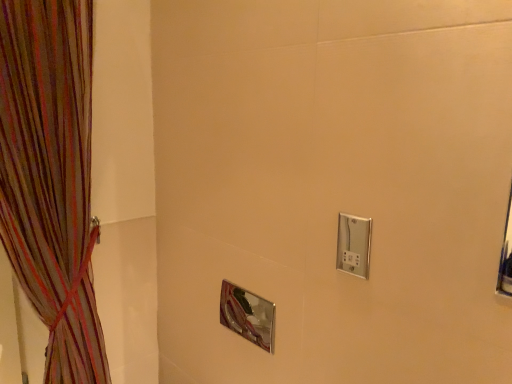
Question: From the image's perspective, is multicolored sheer curtain at left above or below satin nickel switch at upper right?

Choices:
 (A) above
 (B) below

Answer: (A)

Question: From their relative heights in the image, would you say multicolored sheer curtain at left is taller or shorter than satin nickel switch at upper right?

Choices:
 (A) tall
 (B) short

Answer: (A)

Question: Based on their relative distances, which object is farther from the polished chrome mirror at center?

Choices:
 (A) satin nickel switch at upper right
 (B) multicolored sheer curtain at left

Answer: (B)

Question: Based on their relative distances, which object is nearer to the satin nickel switch at upper right?

Choices:
 (A) polished chrome mirror at center
 (B) multicolored sheer curtain at left

Answer: (A)